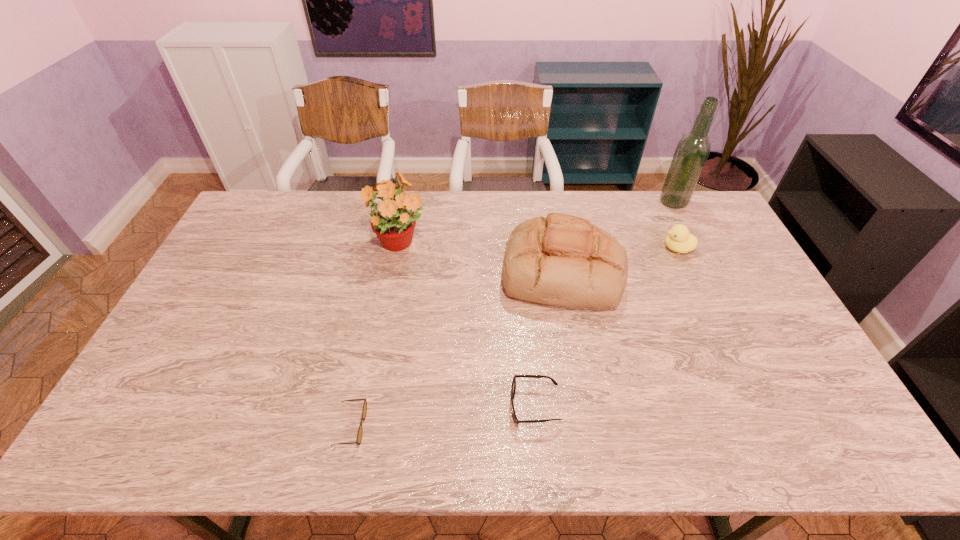
You are a GUI agent. You are given a task and a screenshot of the screen. Output one action in this format:
    pyautogui.click(x=<x>, y=<y>)
    Task: Click on the free location located 0.140m at the beak of the fourth tallest object
    This screenshot has width=960, height=540.
    Given the screenshot: What is the action you would take?
    pyautogui.click(x=621, y=248)

At what (x,y) coordinates should I click in order to perform the action: click on free region located at the beak of the fourth tallest object. Please return your answer as a coordinate pair (x, y). This screenshot has height=540, width=960. Looking at the image, I should click on (612, 248).

Find the location of a particular element. This screenshot has height=540, width=960. vacant area situated 0.060m at the beak of the fourth tallest object is located at coordinates (644, 248).

This screenshot has height=540, width=960. I want to click on free location located 0.120m on the front-facing side of the right sunglasses, so click(x=462, y=406).

Locate an element on the screen. This screenshot has width=960, height=540. vacant region located on the front-facing side of the right sunglasses is located at coordinates (438, 406).

The height and width of the screenshot is (540, 960). What are the coordinates of `vacant point located 0.170m on the front-facing side of the right sunglasses` in the screenshot? It's located at (442, 406).

Find the location of a particular element. This screenshot has height=540, width=960. free space located on the front-facing side of the left sunglasses is located at coordinates (468, 427).

The image size is (960, 540). In order to click on liquor located in the far edge section of the desktop in this screenshot , I will do pyautogui.click(x=692, y=151).

You are a GUI agent. You are given a task and a screenshot of the screen. Output one action in this format:
    pyautogui.click(x=<x>, y=<y>)
    Task: Click on the flowerpot that is at the far edge
    This screenshot has height=540, width=960.
    Given the screenshot: What is the action you would take?
    pyautogui.click(x=394, y=222)

You are a GUI agent. You are given a task and a screenshot of the screen. Output one action in this format:
    pyautogui.click(x=<x>, y=<y>)
    Task: Click on the liquor at the right edge
    
    Given the screenshot: What is the action you would take?
    pyautogui.click(x=692, y=151)